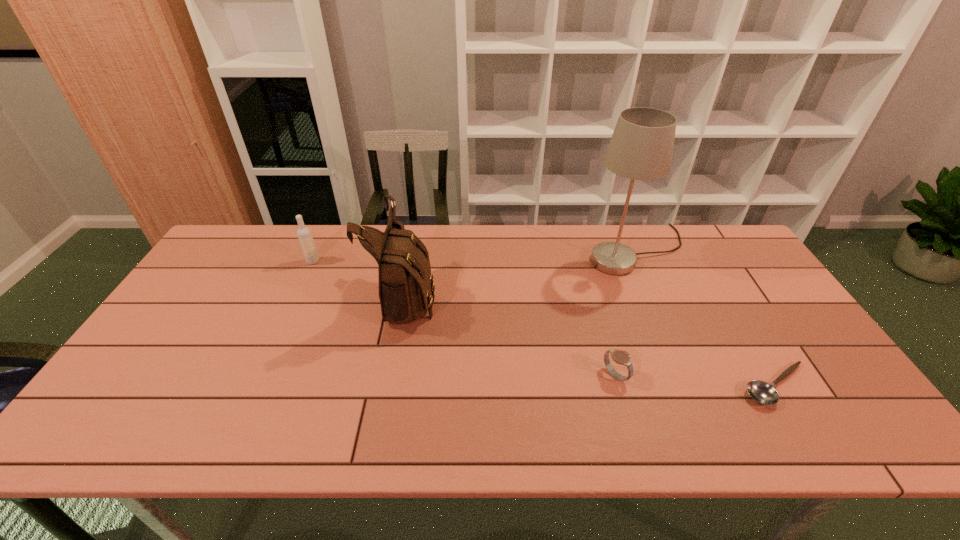
I want to click on empty space that is in between the fourth object from right to left and the shortest object, so click(x=591, y=340).

Find the location of `free space between the table lamp and the third tallest object`. free space between the table lamp and the third tallest object is located at coordinates (474, 256).

This screenshot has height=540, width=960. I want to click on free space that is in between the shortest object and the fourth object from right to left, so click(x=591, y=340).

Image resolution: width=960 pixels, height=540 pixels. In order to click on empty space that is in between the ladle and the leftmost object in this screenshot , I will do `click(544, 323)`.

This screenshot has width=960, height=540. Identify the location of vacant area that lies between the fourth tallest object and the fourth shortest object. (511, 335).

Identify the location of vacant space in between the ladle and the fourth tallest object. This screenshot has width=960, height=540. (696, 381).

Locate an element on the screen. The height and width of the screenshot is (540, 960). free space between the fourth shortest object and the ladle is located at coordinates (591, 340).

Where is `free spot between the vodka and the shortest object`? This screenshot has height=540, width=960. free spot between the vodka and the shortest object is located at coordinates (544, 323).

The height and width of the screenshot is (540, 960). I want to click on free space between the vodka and the watch, so click(464, 318).

Where is `empty space between the shortest object and the fourth tallest object`? This screenshot has width=960, height=540. empty space between the shortest object and the fourth tallest object is located at coordinates (696, 381).